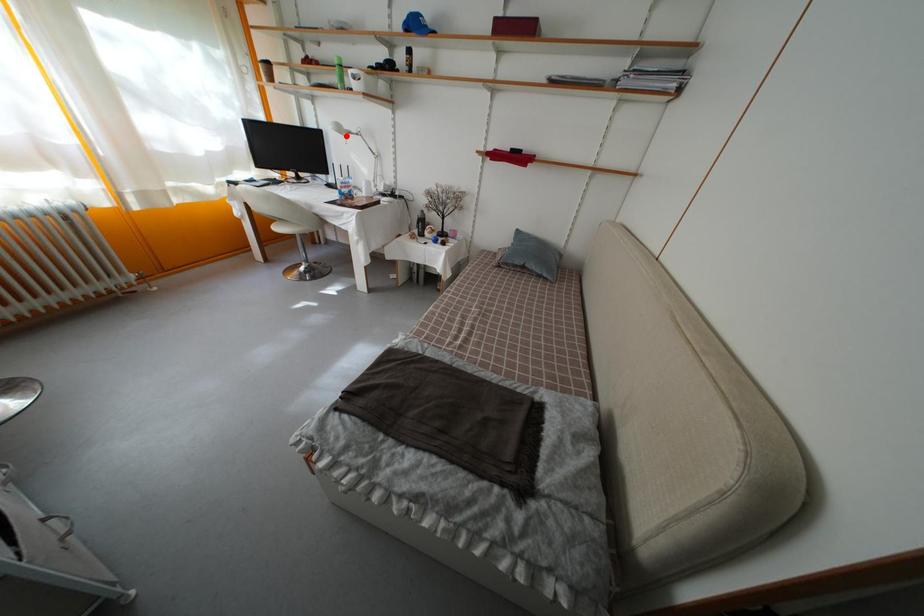
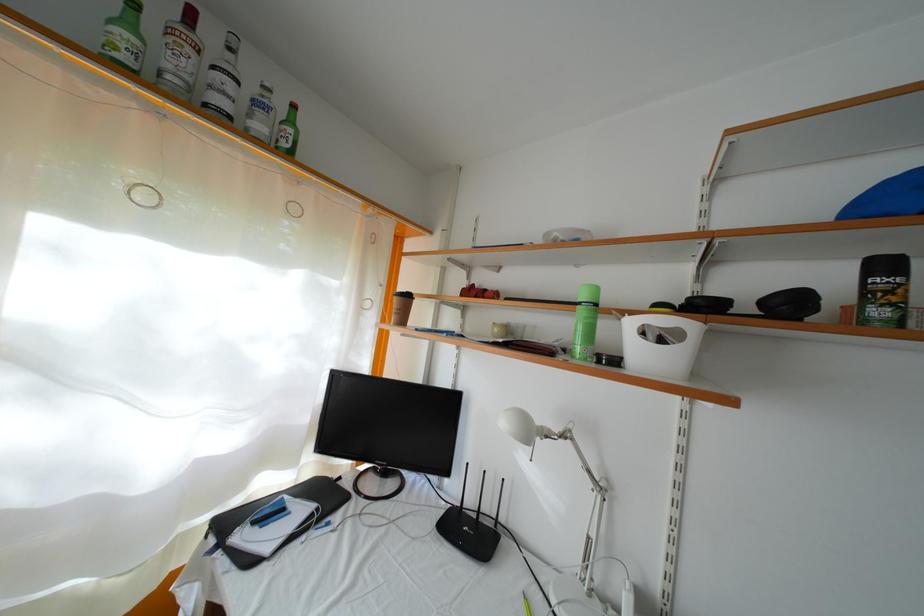
Question: I am providing you with two images of the same scene from different viewpoints. Given a red point in image1, look at the same physical point in image2. Is it:

Choices:
 (A) Closer to the viewpoint
 (B) Farther from the viewpoint

Answer: (B)